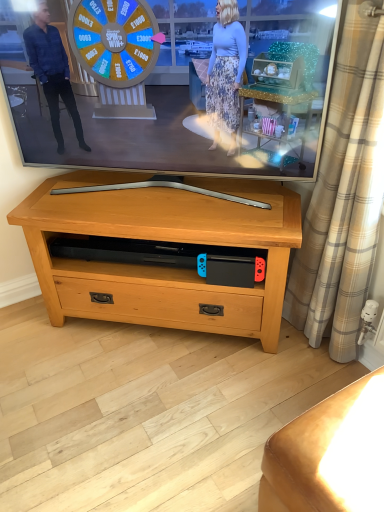
Find the location of a particular element. This screenshot has width=384, height=512. vacant region to the left of beige plaid curtain at right is located at coordinates (285, 369).